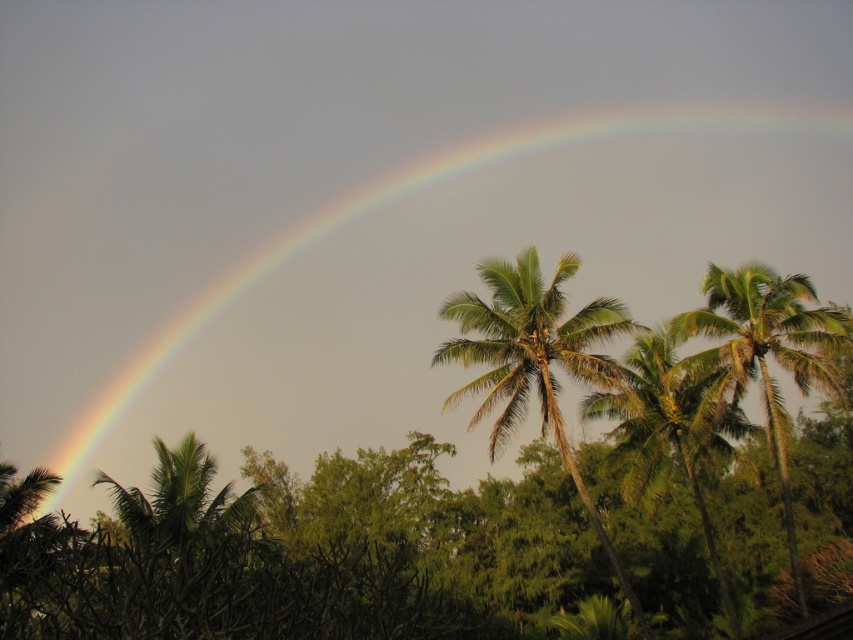
Is rainbow at upper left further to camera compared to green leafy palm at center?

Yes.

Consider the image. Does rainbow at upper left have a greater width compared to green leafy palm at center?

Yes.

Measure the distance between rainbow at upper left and camera.

The distance of rainbow at upper left from camera is 36.36 meters.

Locate an element on the screen. rainbow at upper left is located at coordinates (465, 282).

Can you confirm if green leafy palm at center is positioned to the left of green leafy palm at upper right?

Indeed, green leafy palm at center is positioned on the left side of green leafy palm at upper right.

Based on the photo, who is lower down, green leafy palm at center or green leafy palm at upper right?

green leafy palm at center

Describe the element at coordinates (534, 358) in the screenshot. Image resolution: width=853 pixels, height=640 pixels. I see `green leafy palm at center` at that location.

Where is `green leafy palm at center`? green leafy palm at center is located at coordinates (534, 358).

In the scene shown: Who is positioned more to the right, rainbow at upper left or green leafy palm at upper right?

Positioned to the right is green leafy palm at upper right.

Which is in front, point (569, 225) or point (741, 365)?

Positioned in front is point (741, 365).

Between point (195, 355) and point (732, 298), which one is positioned in front?

Positioned in front is point (732, 298).

Where is `rainbow at upper left`? This screenshot has height=640, width=853. rainbow at upper left is located at coordinates (465, 282).